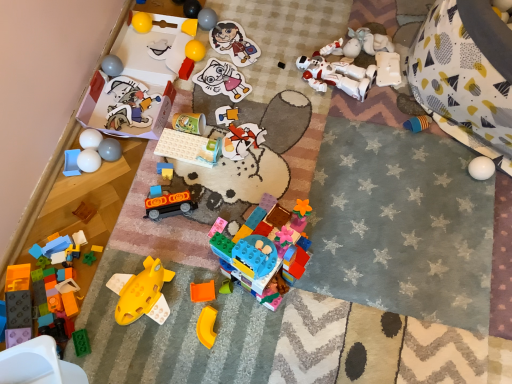
In order to click on empty space that is in between white plastic robot at upper right, arranged as the 22th toy when viewed from the left, and translucent orange plastic at center, arranged as the nineteenth toy when viewed from the left in this screenshot , I will do `click(337, 141)`.